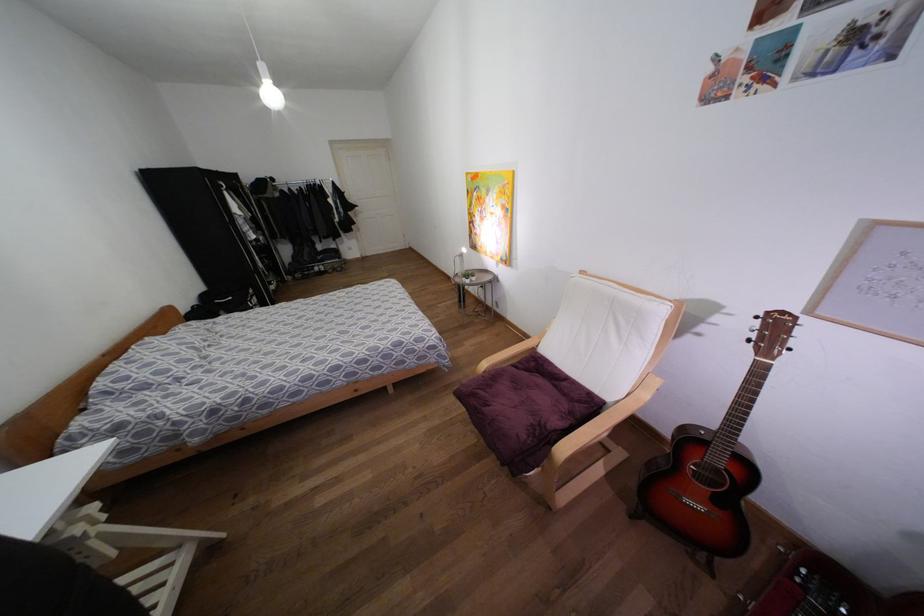
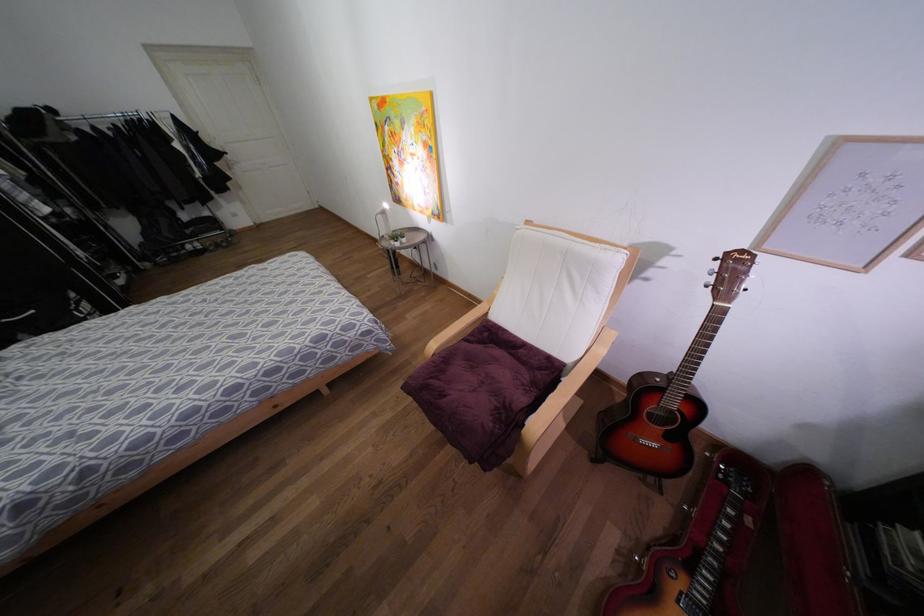
Question: The images are taken continuously from a first-person perspective. In which direction is your viewpoint rotating?

Choices:
 (A) Left
 (B) Right
 (C) Up
 (D) Down

Answer: (B)